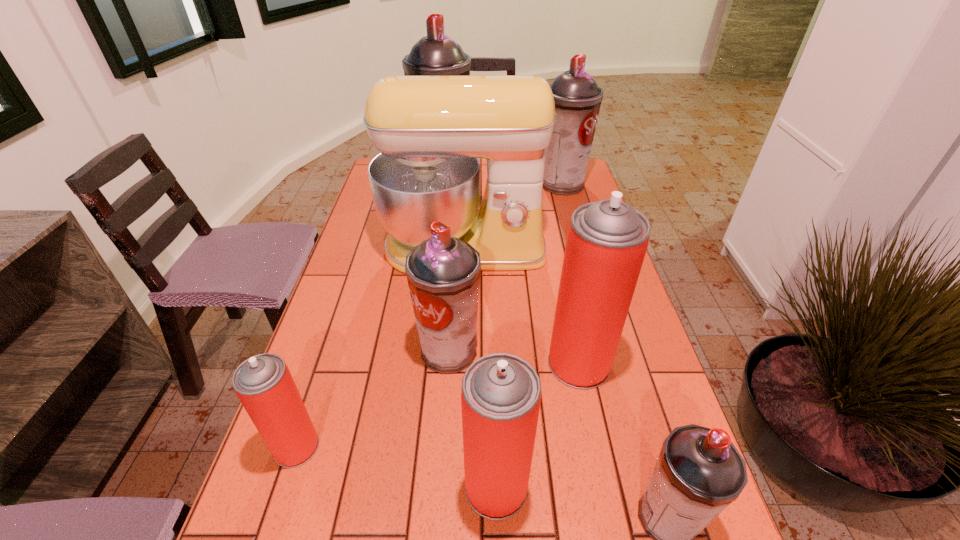
Find the location of a particular element. The image size is (960, 540). vacant space situated on the side of the mixer with the control knob is located at coordinates (458, 382).

Locate an element on the screen. The height and width of the screenshot is (540, 960). vacant area located 0.250m on the left of the second biggest gray aerosol can is located at coordinates (469, 184).

Identify the location of free space located on the front of the rightmost red aerosol can. The image size is (960, 540). (602, 471).

Locate an element on the screen. The image size is (960, 540). free space located on the back of the third farthest gray aerosol can is located at coordinates (452, 310).

This screenshot has height=540, width=960. What are the coordinates of `free space located on the right of the second red aerosol can from right to left` in the screenshot? It's located at (555, 487).

The height and width of the screenshot is (540, 960). I want to click on vacant area situated on the right of the smallest red aerosol can, so click(x=516, y=447).

Identify the location of mixer that is at the left edge. (430, 131).

Identify the location of object located at the far left corner. Image resolution: width=960 pixels, height=540 pixels. 436,54.

Where is `object that is at the far right corner`? This screenshot has height=540, width=960. object that is at the far right corner is located at coordinates (577, 97).

Locate an element on the screen. The image size is (960, 540). free space at the left edge of the desktop is located at coordinates (347, 248).